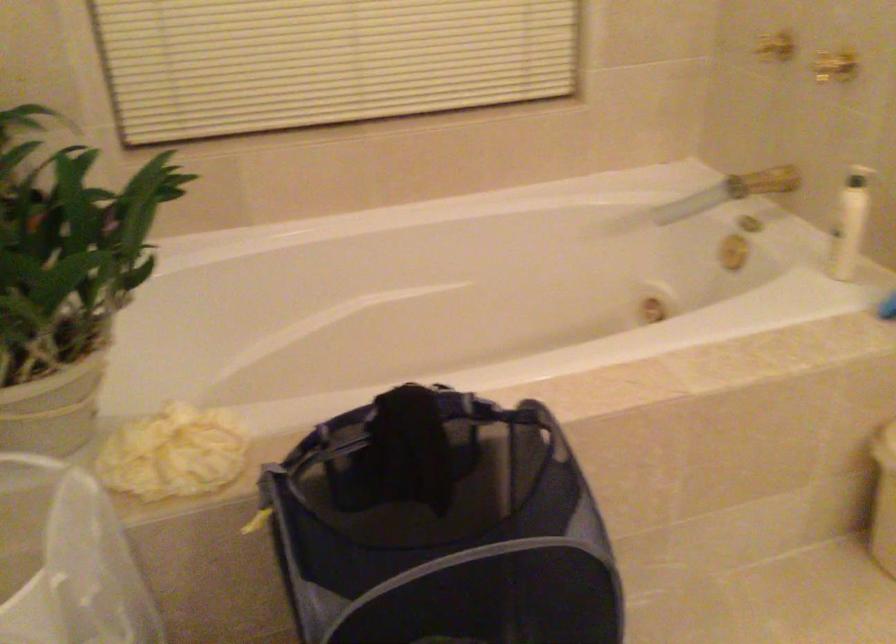
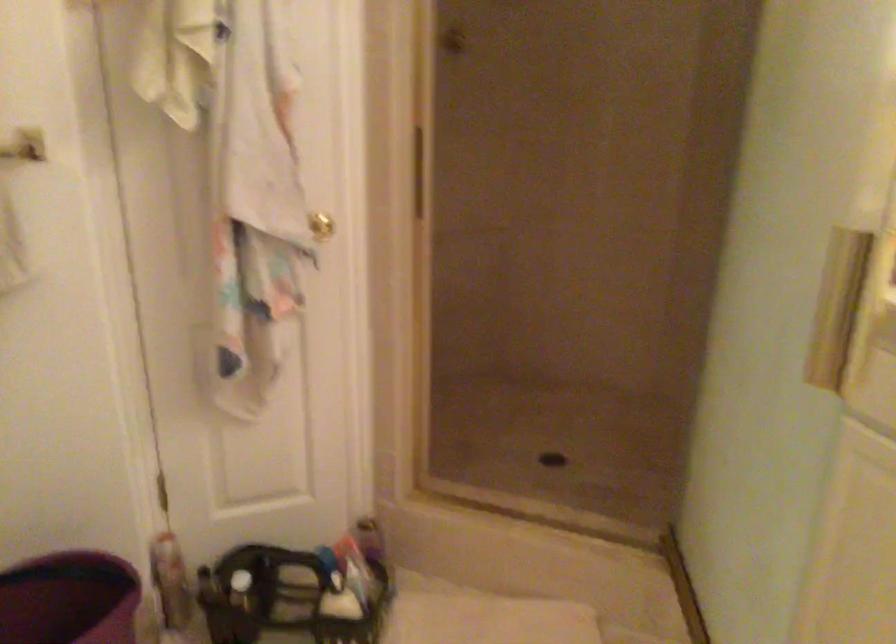
The first image is from the beginning of the video and the second image is from the end. How did the camera likely rotate when shooting the video?

The camera rotated toward right-down.